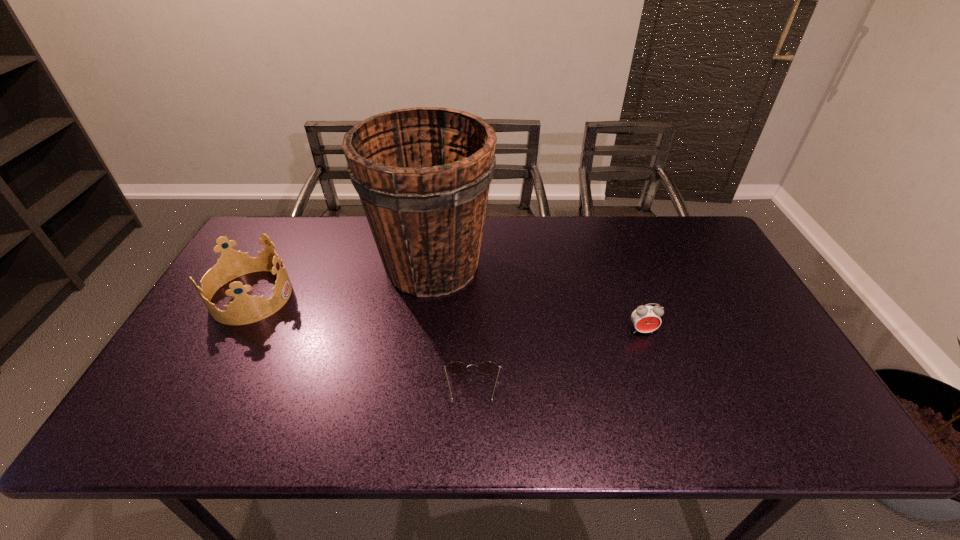
You are a GUI agent. You are given a task and a screenshot of the screen. Output one action in this format:
    pyautogui.click(x=<x>, y=<y>)
    Task: Click on the object that is positioned at the far edge
    The width and height of the screenshot is (960, 540).
    Given the screenshot: What is the action you would take?
    pyautogui.click(x=423, y=174)

Locate an element on the screen. object present at the near edge is located at coordinates (456, 367).

The image size is (960, 540). In order to click on object situated at the left edge in this screenshot , I will do `click(245, 309)`.

Find the location of `free space at the far edge of the desktop`. free space at the far edge of the desktop is located at coordinates coord(372,241).

The height and width of the screenshot is (540, 960). Identify the location of vacant space at the near edge of the desktop. click(283, 411).

You are a GUI agent. You are given a task and a screenshot of the screen. Output one action in this format:
    pyautogui.click(x=<x>, y=<y>)
    Task: Click on the vacant space at the left edge of the desktop
    
    Given the screenshot: What is the action you would take?
    pyautogui.click(x=253, y=326)

Locate an element on the screen. Image resolution: width=960 pixels, height=540 pixels. vacant region at the right edge of the desktop is located at coordinates (685, 280).

Image resolution: width=960 pixels, height=540 pixels. In the image, there is a desktop. Identify the location of vacant space at the far left corner. (276, 247).

You are a GUI agent. You are given a task and a screenshot of the screen. Output one action in this format:
    pyautogui.click(x=<x>, y=<y>)
    Task: Click on the vacant space at the far right corner of the desktop
    
    Given the screenshot: What is the action you would take?
    pyautogui.click(x=700, y=251)

Where is `vacant space in between the bucket and the shortest object`? This screenshot has height=540, width=960. vacant space in between the bucket and the shortest object is located at coordinates (452, 328).